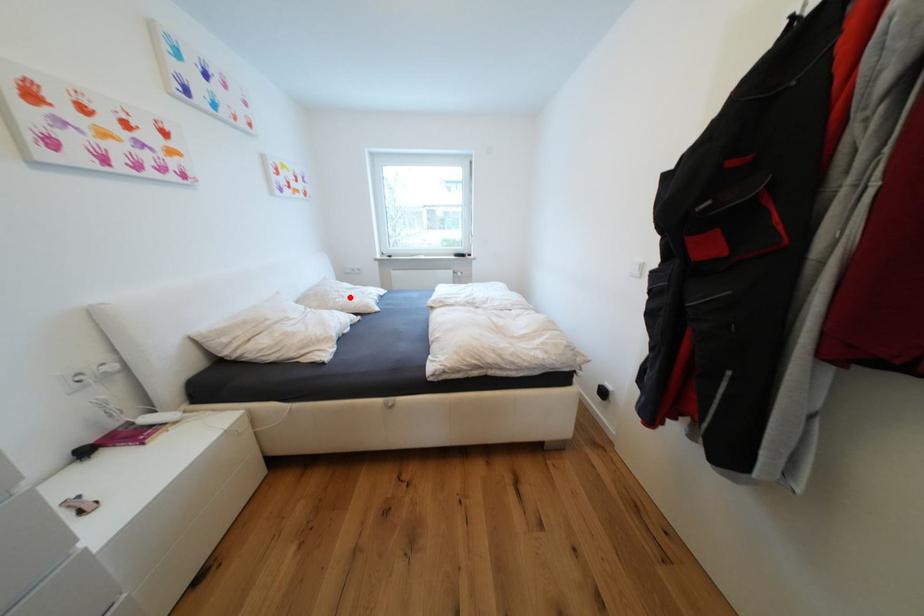
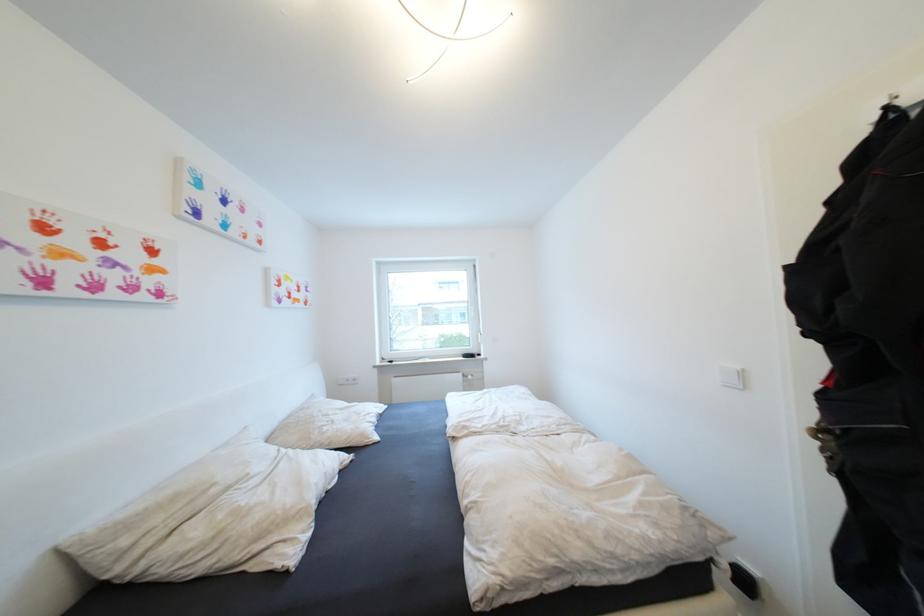
Find the pixel in the second image that matches the highlighted location in the first image.

(339, 423)